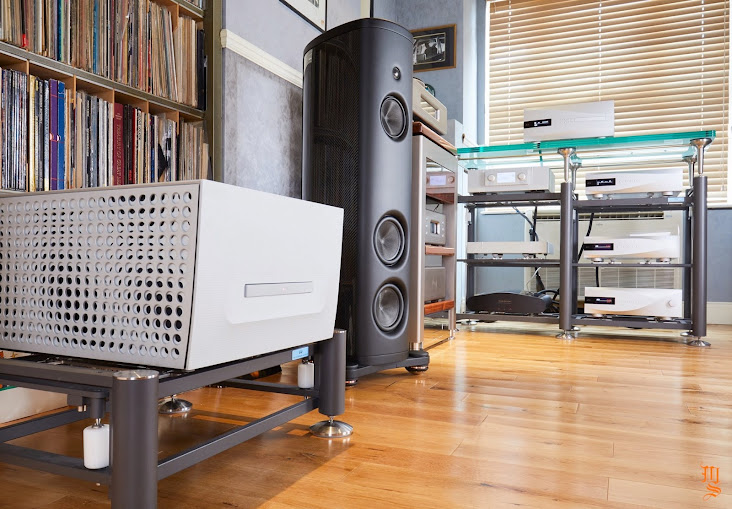
Where is `file folders in cabinet`? file folders in cabinet is located at coordinates (168, 52), (78, 142).